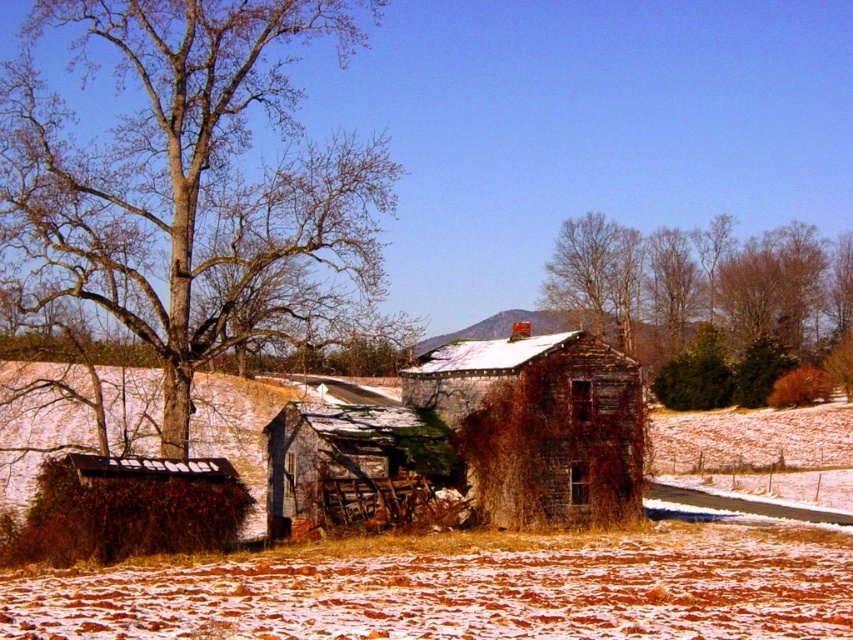
Question: Which object appears farthest from the camera in this image?

Choices:
 (A) rusty stone hut at center
 (B) brown textured tree at left

Answer: (A)

Question: Which object is positioned closest to the brown textured tree at left?

Choices:
 (A) rusty metal hut at center
 (B) rusty stone hut at center
 (C) brown textured tree at upper right

Answer: (A)

Question: Which object is positioned closest to the brown textured tree at left?

Choices:
 (A) brown textured tree at upper right
 (B) rusty stone hut at center
 (C) rusty metal hut at center

Answer: (C)

Question: Is brown textured tree at left above brown textured tree at upper right?

Choices:
 (A) yes
 (B) no

Answer: (A)

Question: In this image, where is brown textured tree at left located relative to rusty metal hut at center?

Choices:
 (A) above
 (B) below

Answer: (A)

Question: Observing the image, what is the correct spatial positioning of brown textured tree at upper right in reference to rusty stone hut at center?

Choices:
 (A) below
 (B) above

Answer: (B)